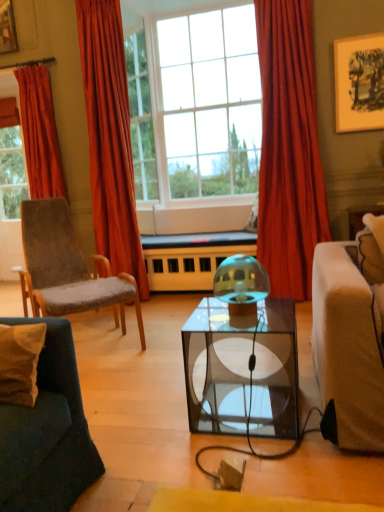
You are a GUI agent. You are given a task and a screenshot of the screen. Output one action in this format:
    pyautogui.click(x=<x>, y=<y>)
    Task: Click on the free space above transparent glass coffee table at center (from a real-world perspective)
    
    Given the screenshot: What is the action you would take?
    pyautogui.click(x=243, y=315)